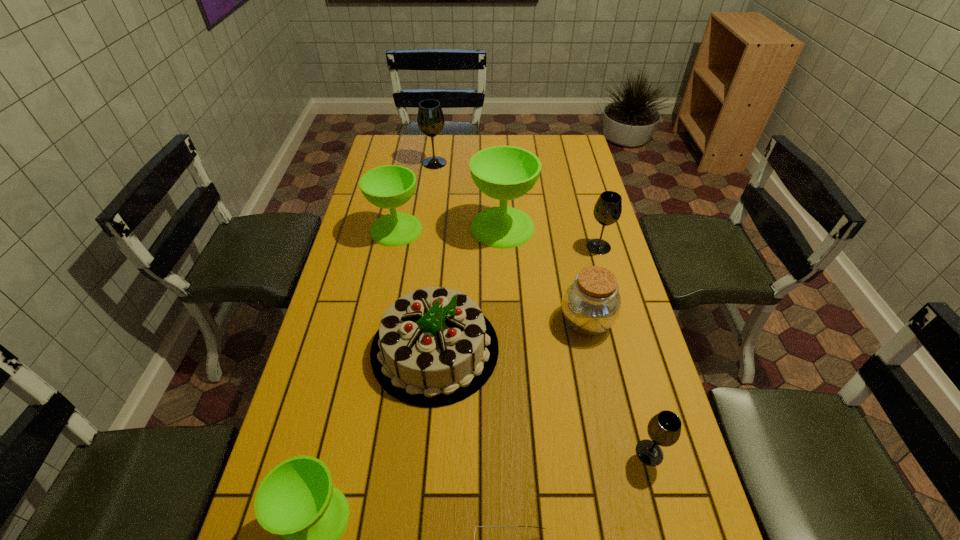
Find the location of a particular element. The image size is (960, 540). the biggest green wineglass is located at coordinates (505, 173).

This screenshot has width=960, height=540. In order to click on the rightmost green wineglass in this screenshot , I will do `click(505, 173)`.

Find the location of a particular element. Image resolution: width=960 pixels, height=540 pixels. the farthest wineglass is located at coordinates (430, 118).

Identify the location of the biggest gray wineglass. (430, 118).

The image size is (960, 540). What are the coordinates of `green birthday cake` in the screenshot? It's located at (434, 347).

Find the location of a particular element. The image size is (960, 540). the second farthest gray wineglass is located at coordinates (607, 210).

At what (x,y) coordinates should I click in order to perform the action: click on the second biggest green wineglass. Please return your answer as a coordinate pair (x, y). Looking at the image, I should click on (390, 186).

Identify the location of jar. (591, 304).

Identify the location of the nearest gray wineglass. (664, 429).

Locate an element on the screen. Image resolution: width=960 pixels, height=540 pixels. the seventh farthest object is located at coordinates (664, 429).